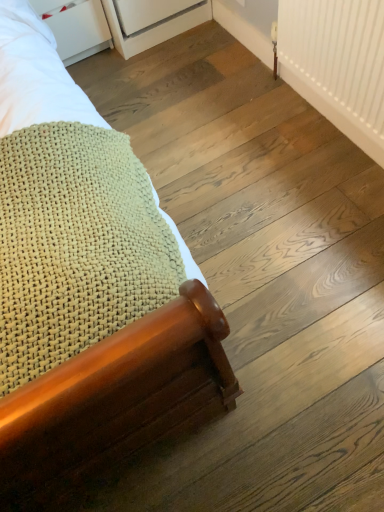
Question: Could white plastic radiator at upper right be considered to be inside wooden bed frame at lower left?

Choices:
 (A) yes
 (B) no

Answer: (B)

Question: From the image's perspective, is wooden bed frame at lower left over white plastic radiator at upper right?

Choices:
 (A) no
 (B) yes

Answer: (A)

Question: Is wooden bed frame at lower left wider than white plastic radiator at upper right?

Choices:
 (A) no
 (B) yes

Answer: (B)

Question: Is wooden bed frame at lower left positioned before white plastic radiator at upper right?

Choices:
 (A) yes
 (B) no

Answer: (A)

Question: From a real-world perspective, is wooden bed frame at lower left located beneath white plastic radiator at upper right?

Choices:
 (A) yes
 (B) no

Answer: (B)

Question: Considering the positions of white matte drawer at upper left and white plastic radiator at upper right in the image, is white matte drawer at upper left bigger or smaller than white plastic radiator at upper right?

Choices:
 (A) small
 (B) big

Answer: (B)

Question: Is point (92, 46) closer or farther from the camera than point (326, 41)?

Choices:
 (A) closer
 (B) farther

Answer: (B)

Question: From the image's perspective, is white matte drawer at upper left above or below white plastic radiator at upper right?

Choices:
 (A) above
 (B) below

Answer: (A)

Question: Considering the relative positions of white matte drawer at upper left and white plastic radiator at upper right in the image provided, is white matte drawer at upper left to the left or to the right of white plastic radiator at upper right?

Choices:
 (A) left
 (B) right

Answer: (A)

Question: Visually, is white plastic radiator at upper right positioned to the left or to the right of wooden bed frame at lower left?

Choices:
 (A) right
 (B) left

Answer: (A)

Question: Considering the positions of point (370, 28) and point (51, 342), is point (370, 28) closer or farther from the camera than point (51, 342)?

Choices:
 (A) closer
 (B) farther

Answer: (B)

Question: Looking at the image, does white plastic radiator at upper right seem bigger or smaller compared to wooden bed frame at lower left?

Choices:
 (A) big
 (B) small

Answer: (B)

Question: Choose the correct answer: Is white plastic radiator at upper right inside wooden bed frame at lower left or outside it?

Choices:
 (A) outside
 (B) inside

Answer: (A)

Question: Based on their positions, is white plastic radiator at upper right located to the left or right of white matte drawer at upper left?

Choices:
 (A) right
 (B) left

Answer: (A)

Question: Is white plastic radiator at upper right wider or thinner than white matte drawer at upper left?

Choices:
 (A) thin
 (B) wide

Answer: (A)